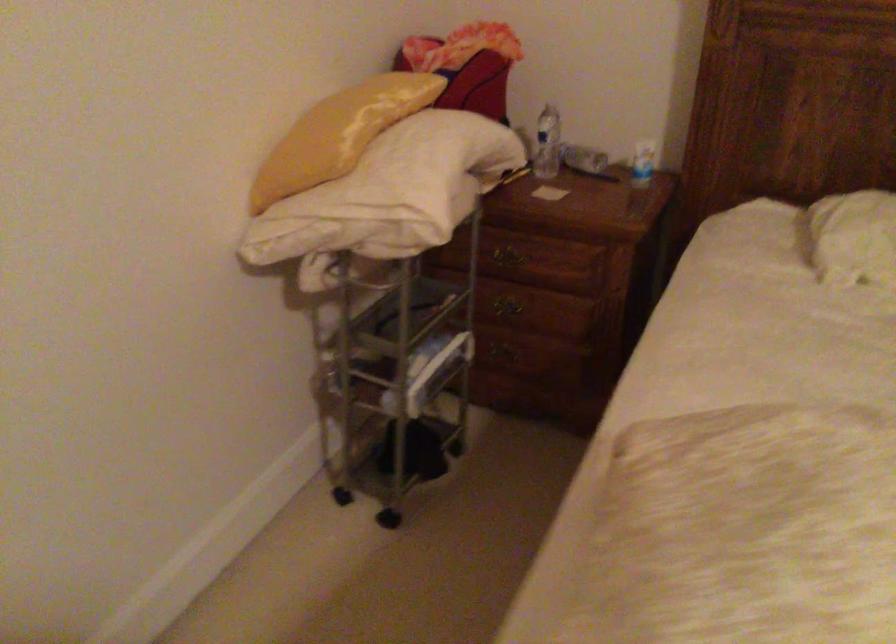
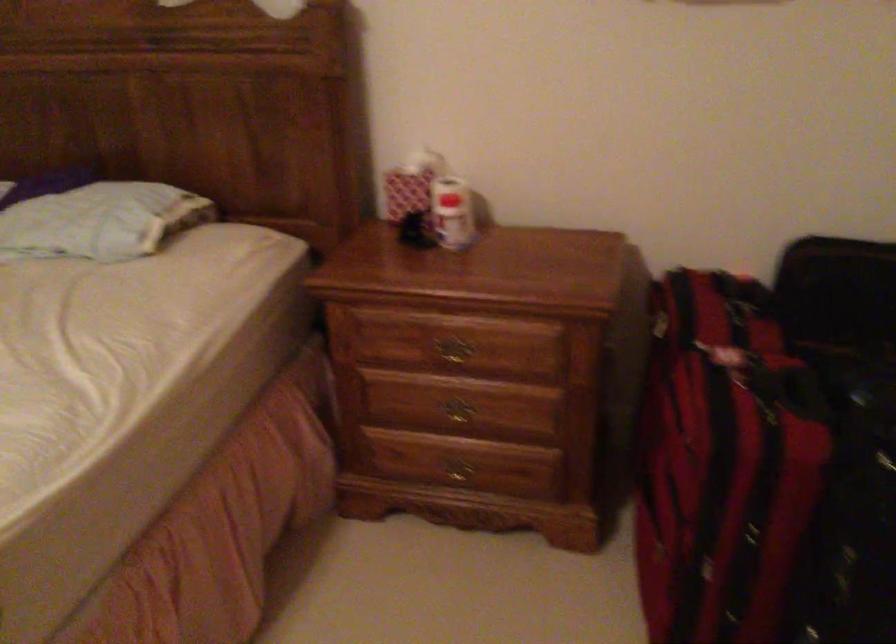
Question: The images are taken continuously from a first-person perspective. In which direction are you moving?

Choices:
 (A) Left
 (B) Right
 (C) Forward
 (D) Backward

Answer: (B)